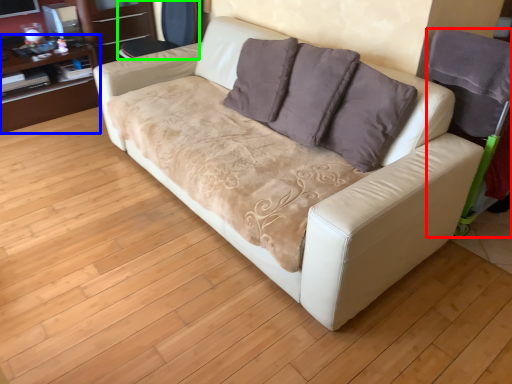
Question: Which is nearer to the armchair (highlighted by a red box)? dresser (highlighted by a blue box) or armchair (highlighted by a green box).

Choices:
 (A) dresser
 (B) armchair

Answer: (B)